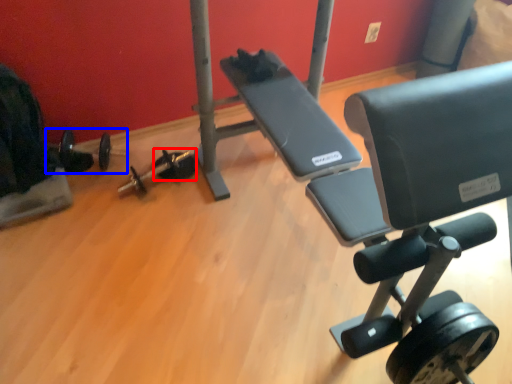
Question: Which object appears closest to the camera in this image, dumbbell (highlighted by a red box) or barbell (highlighted by a blue box)?

Choices:
 (A) dumbbell
 (B) barbell

Answer: (B)